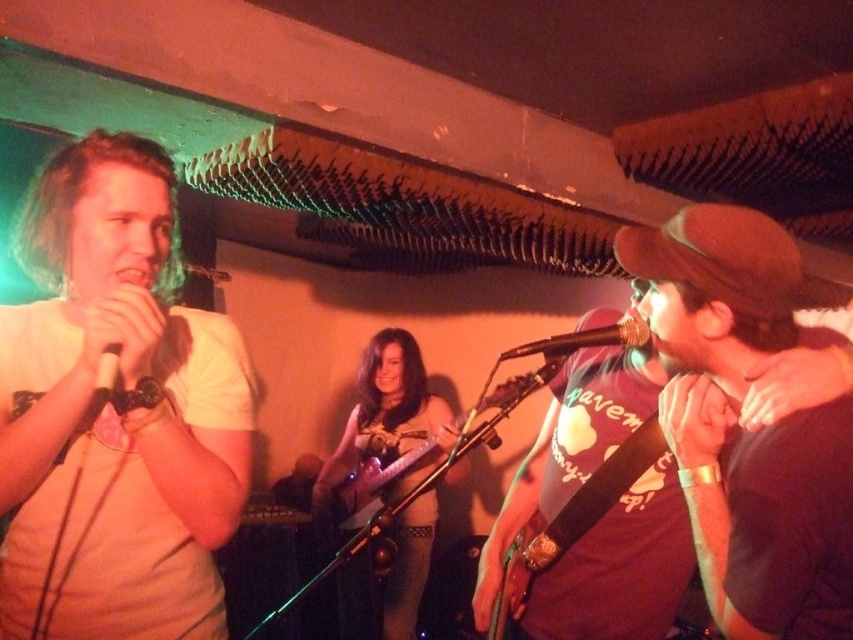
You are a stagehand setting up equipment for a performance. You have to place a new stand for the wooden acoustic guitar at center and the metallic silver microphone at center. Based on the scene description, which object requires a taller stand?

The wooden acoustic guitar at center requires a taller stand because it is taller than the metallic silver microphone at center.

Consider the image. Based on the scene description, where is the brown fabric cap at upper right located in terms of its 2D coordinates?

The brown fabric cap at upper right is located at the 2D coordinates of point (665, 355).

You are a stagehand who needs to place a new stand for the wooden acoustic guitar at center and the metallic silver microphone at center. Which object requires a wider stand based on their sizes?

The wooden acoustic guitar at center requires a wider stand since its width is larger than the metallic silver microphone at center.